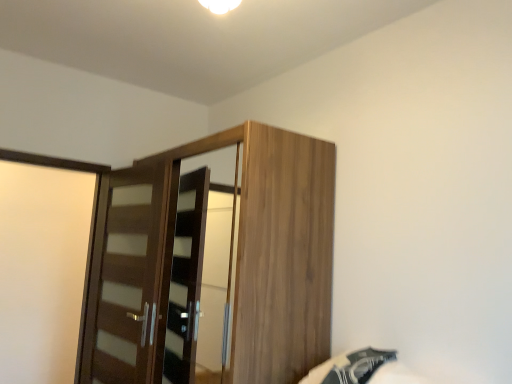
Question: Considering the relative sizes of wooden wardrobe at center and black fabric bed at lower right in the image provided, is wooden wardrobe at center wider than black fabric bed at lower right?

Choices:
 (A) no
 (B) yes

Answer: (B)

Question: Considering the relative positions of wooden wardrobe at center and black fabric bed at lower right in the image provided, is wooden wardrobe at center to the left of black fabric bed at lower right from the viewer's perspective?

Choices:
 (A) yes
 (B) no

Answer: (A)

Question: Is wooden wardrobe at center touching black fabric bed at lower right?

Choices:
 (A) no
 (B) yes

Answer: (A)

Question: Can you confirm if wooden wardrobe at center is smaller than black fabric bed at lower right?

Choices:
 (A) yes
 (B) no

Answer: (B)

Question: Does wooden wardrobe at center lie in front of black fabric bed at lower right?

Choices:
 (A) yes
 (B) no

Answer: (B)

Question: From a real-world perspective, does wooden wardrobe at center stand above black fabric bed at lower right?

Choices:
 (A) yes
 (B) no

Answer: (A)

Question: Is brown wood door at left beside wooden wardrobe at center?

Choices:
 (A) yes
 (B) no

Answer: (B)

Question: Can you confirm if brown wood door at left is shorter than wooden wardrobe at center?

Choices:
 (A) no
 (B) yes

Answer: (B)

Question: Considering the relative sizes of brown wood door at left and wooden wardrobe at center in the image provided, is brown wood door at left bigger than wooden wardrobe at center?

Choices:
 (A) yes
 (B) no

Answer: (B)

Question: Are brown wood door at left and wooden wardrobe at center located far from each other?

Choices:
 (A) yes
 (B) no

Answer: (B)

Question: From a real-world perspective, is brown wood door at left under wooden wardrobe at center?

Choices:
 (A) no
 (B) yes

Answer: (B)

Question: Is brown wood door at left positioned beyond the bounds of wooden wardrobe at center?

Choices:
 (A) no
 (B) yes

Answer: (B)

Question: From the image's perspective, does black fabric bed at lower right appear lower than brown wood door at left?

Choices:
 (A) yes
 (B) no

Answer: (A)